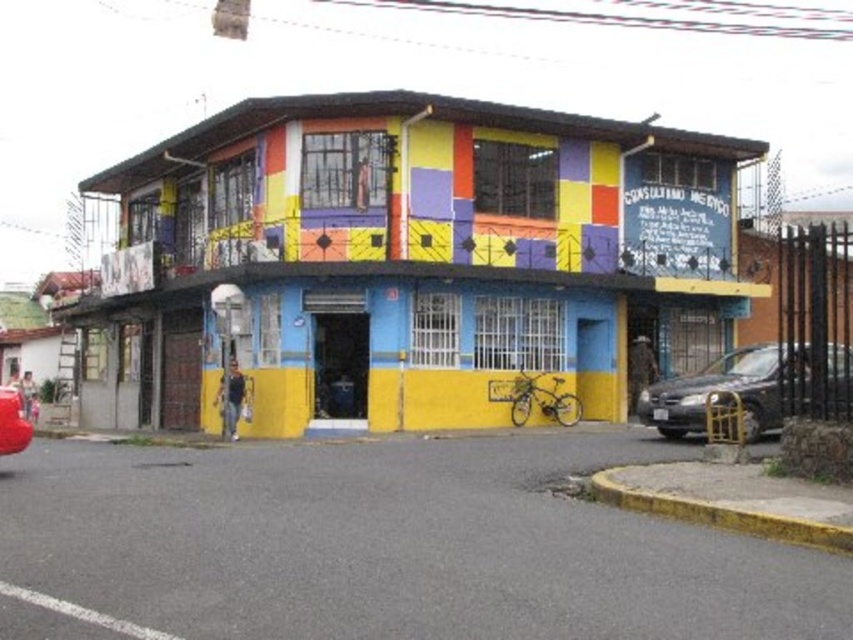
Question: Which point is closer to the camera?

Choices:
 (A) rubberized red car at lower left
 (B) dark gray metallic car at lower right

Answer: (A)

Question: Can you confirm if dark gray metallic car at lower right is positioned above rubberized red car at lower left?

Choices:
 (A) yes
 (B) no

Answer: (A)

Question: Is dark gray metallic car at lower right further to the viewer compared to rubberized red car at lower left?

Choices:
 (A) no
 (B) yes

Answer: (B)

Question: Does dark gray metallic car at lower right have a smaller size compared to rubberized red car at lower left?

Choices:
 (A) no
 (B) yes

Answer: (B)

Question: Which of the following is the farthest from the observer?

Choices:
 (A) dark gray metallic car at lower right
 (B) rubberized red car at lower left

Answer: (A)